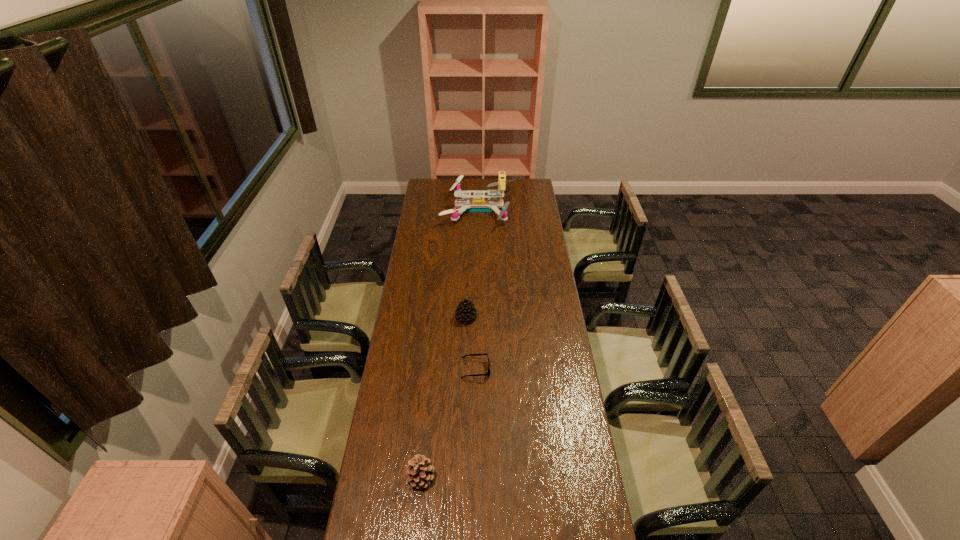
Where is `the tallest object`? The height and width of the screenshot is (540, 960). the tallest object is located at coordinates (478, 204).

Find the location of a particular element. The width and height of the screenshot is (960, 540). drone is located at coordinates (478, 204).

Where is `the right pinecone`? This screenshot has height=540, width=960. the right pinecone is located at coordinates (465, 312).

Find the location of `the farther pinecone`. the farther pinecone is located at coordinates (465, 312).

You are a GUI agent. You are given a task and a screenshot of the screen. Output one action in this format:
    pyautogui.click(x=<x>, y=<y>)
    Task: Click on the nearest object
    The image size is (960, 540).
    Given the screenshot: What is the action you would take?
    pyautogui.click(x=419, y=473)

In order to click on the left pinecone in this screenshot , I will do [x=419, y=473].

Find the location of a particular element. The image size is (960, 540). the second nearest object is located at coordinates (488, 373).

Identify the location of the shortest object. The image size is (960, 540). (488, 373).

You are a GUI agent. You are given a task and a screenshot of the screen. Output one action in this format:
    pyautogui.click(x=<x>, y=<y>)
    Task: Click on the blank area located on the front-facing side of the farthest object
    The image size is (960, 540).
    Given the screenshot: What is the action you would take?
    pyautogui.click(x=530, y=209)

The height and width of the screenshot is (540, 960). Identify the location of free point located at the narrow end of the right pinecone. (465, 347).